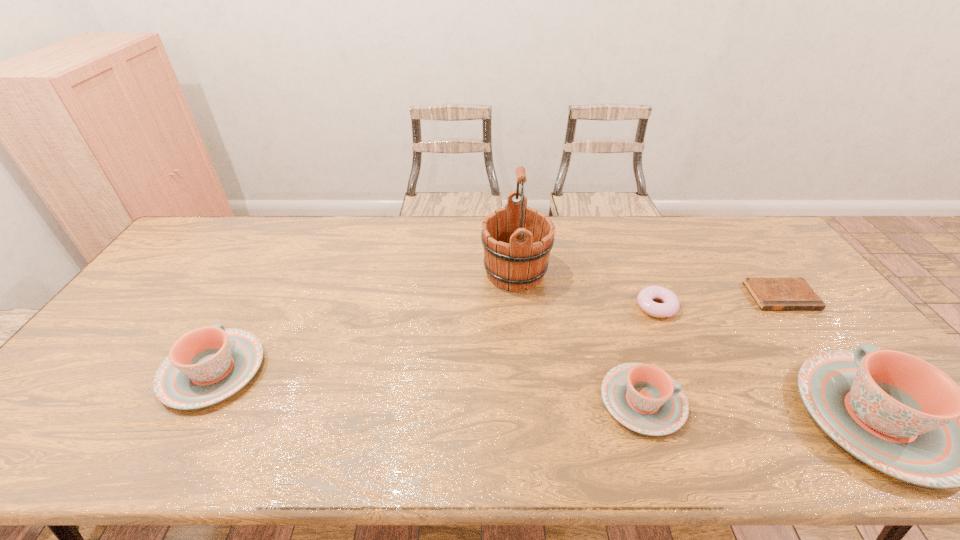
Find the location of a particular element. This screenshot has width=960, height=540. the third tallest object is located at coordinates (207, 365).

This screenshot has height=540, width=960. I want to click on the leftmost object, so click(207, 365).

The height and width of the screenshot is (540, 960). I want to click on the second chinaware from left to right, so click(x=642, y=397).

Find the location of a particular element. the shortest chinaware is located at coordinates [642, 397].

Where is `doughnut`? The height and width of the screenshot is (540, 960). doughnut is located at coordinates (670, 305).

You are a GUI agent. You are given a task and a screenshot of the screen. Output one action in this format:
    pyautogui.click(x=<x>, y=<y>)
    Task: Click on the wine bucket
    The width and height of the screenshot is (960, 540).
    Given the screenshot: What is the action you would take?
    pyautogui.click(x=517, y=240)

In order to click on the fifth object from right to left in this screenshot , I will do `click(517, 240)`.

This screenshot has width=960, height=540. Identify the location of the shortest object. (769, 293).

This screenshot has width=960, height=540. Find the location of `vacant area located on the handle side of the second shortest chinaware`. vacant area located on the handle side of the second shortest chinaware is located at coordinates (282, 247).

At what (x,y) coordinates should I click in order to perform the action: click on vacant space located 0.120m on the handle side of the second shortest chinaware. Please return your answer as a coordinate pair (x, y). Looking at the image, I should click on (251, 303).